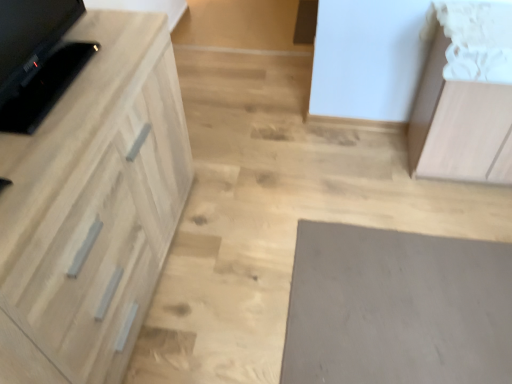
Where is `empty space that is in between light wood cabinet at left, acting as the 2th cabinetry starting from the right, and light brown wood cabinet at upper right, the 2th cabinetry viewed from the left`? Image resolution: width=512 pixels, height=384 pixels. empty space that is in between light wood cabinet at left, acting as the 2th cabinetry starting from the right, and light brown wood cabinet at upper right, the 2th cabinetry viewed from the left is located at coordinates (295, 220).